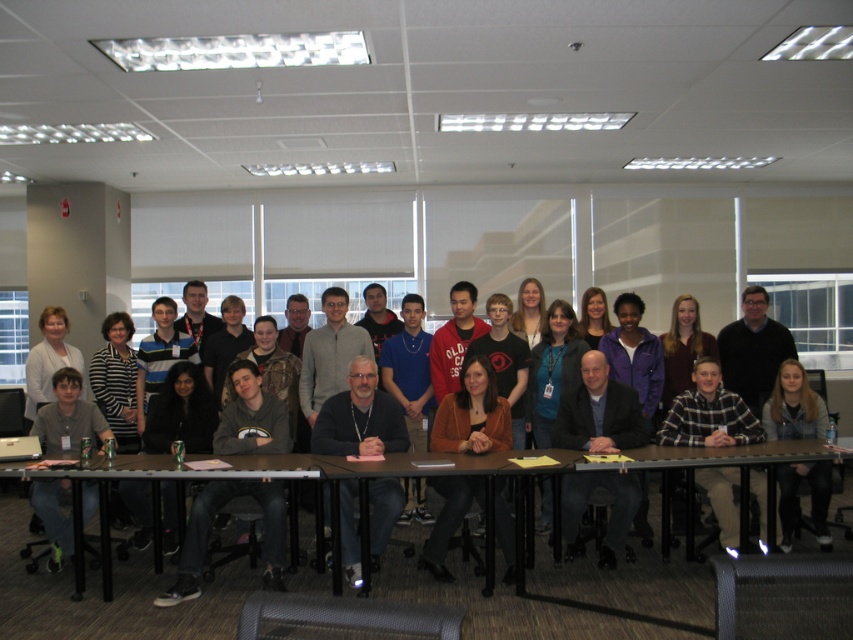
Question: Which object is farther from the camera taking this photo?

Choices:
 (A) matte gray shirt at lower left
 (B) dark gray sweater at center

Answer: (A)

Question: Which point is farther from the camera taking this photo?

Choices:
 (A) (x=161, y=460)
 (B) (x=334, y=467)

Answer: (A)

Question: Can you confirm if metallic gray table at center is thinner than matte gray shirt at lower left?

Choices:
 (A) yes
 (B) no

Answer: (B)

Question: Does matte gray shirt at lower left have a larger size compared to wooden table at center?

Choices:
 (A) yes
 (B) no

Answer: (B)

Question: Which object is farther from the camera taking this photo?

Choices:
 (A) wooden table at lower center
 (B) wooden table at center
 (C) light brown hair at lower right
 (D) dark gray sweater at center

Answer: (C)

Question: Is metallic gray table at center to the left of dark gray sweater at center from the viewer's perspective?

Choices:
 (A) no
 (B) yes

Answer: (B)